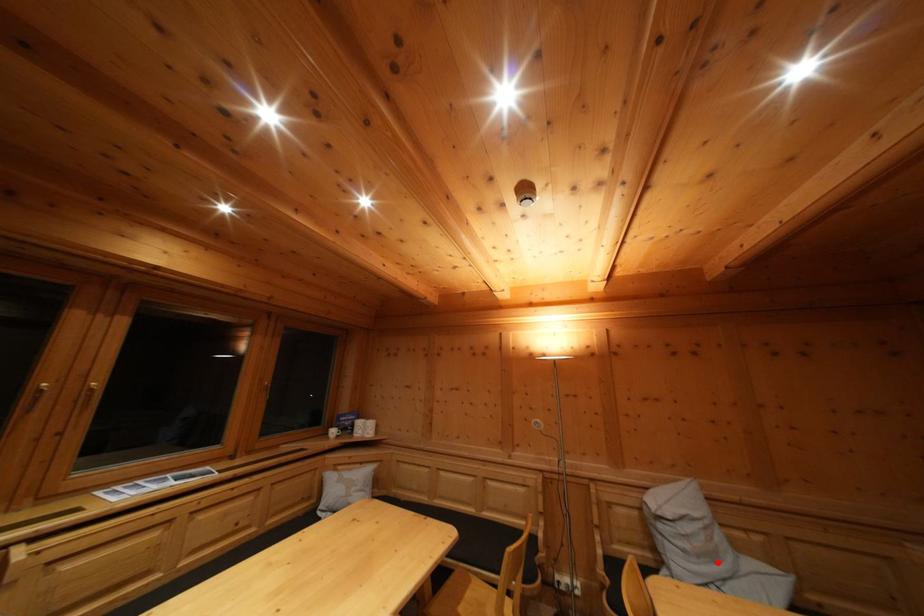
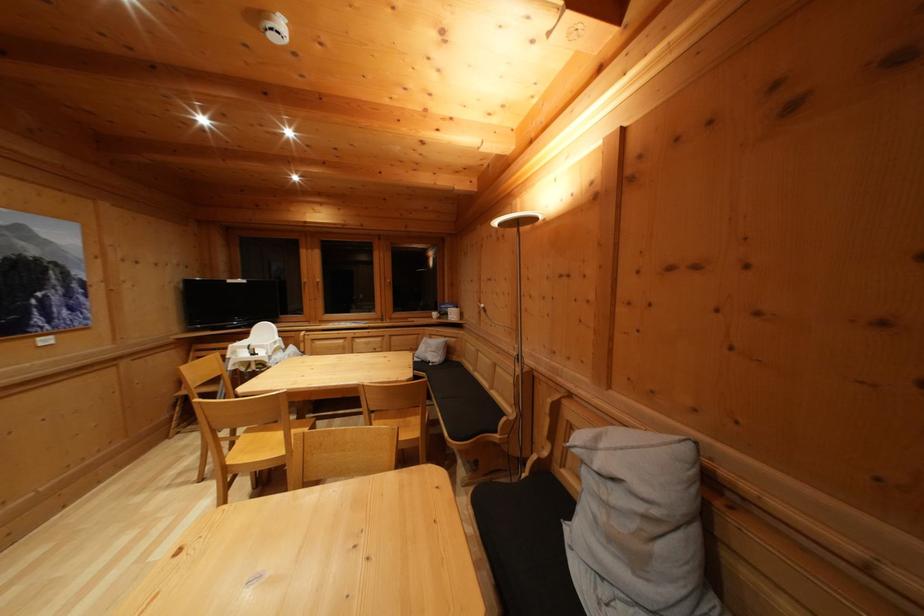
Where in the second image is the point corresponding to the highlighted location from the first image?

(640, 565)